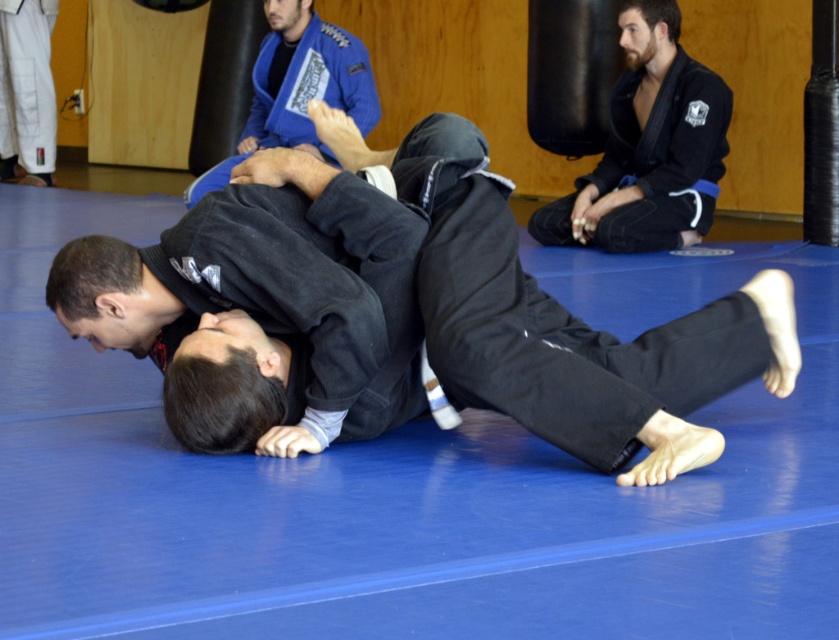
Question: Does black matte gi at upper right have a greater width compared to blue fabric gi at upper center?

Choices:
 (A) no
 (B) yes

Answer: (A)

Question: Is black matte gi at center smaller than blue fabric gi at upper center?

Choices:
 (A) yes
 (B) no

Answer: (A)

Question: Which object appears closest to the camera in this image?

Choices:
 (A) blue fabric gi at upper center
 (B) black matte gi at center

Answer: (B)

Question: Which object appears farthest from the camera in this image?

Choices:
 (A) blue fabric gi at upper center
 (B) black matte gi at upper right

Answer: (A)

Question: Is black matte gi at center wider than black matte gi at upper right?

Choices:
 (A) yes
 (B) no

Answer: (A)

Question: Which of these objects is positioned farthest from the black matte gi at upper right?

Choices:
 (A) blue fabric gi at upper center
 (B) black matte gi at center

Answer: (B)